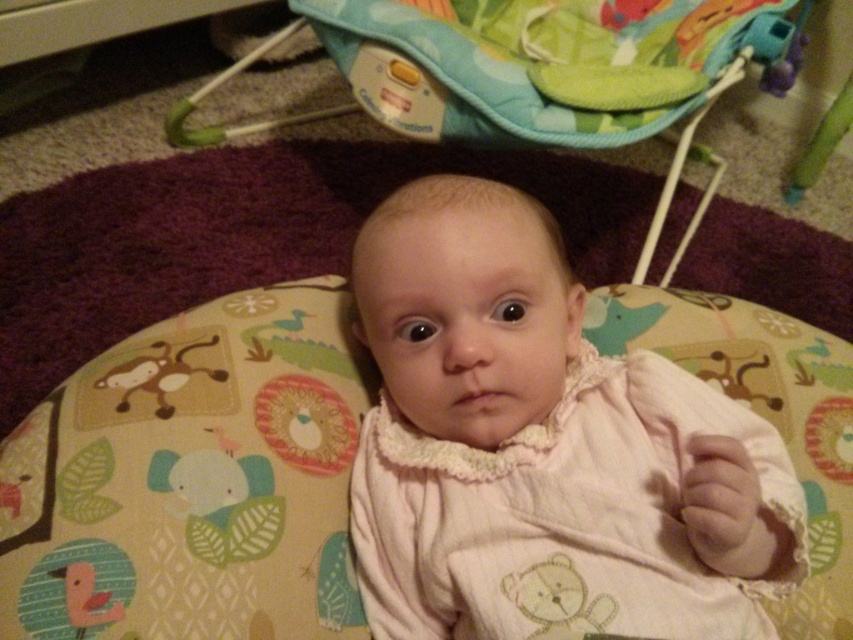
You are a parent trying to choose between placing your baby in the soft fabric baby bed at center or the multicolored fabric baby carriage at center. Which option would you choose if you want the larger one?

The multicolored fabric baby carriage at center is larger than the soft fabric baby bed at center, so you should choose the multicolored fabric baby carriage at center.

You are a parent holding a toy that is 12 inches long. You want to place it in front of the baby so that the baby can easily reach it. Given the point marked at coordinate point (392, 504), which is 28.80 inches away from you, can you determine if placing the toy at that point would be within the baby s reach?

The point marked at coordinate point (392, 504) is 28.80 inches away from the viewer. Since the toy is 12 inches long, placing it at that point would require the baby to reach 28.80 inches away, which is likely beyond the baby s typical reach range. Therefore, placing the toy at that point may not be within the baby s reach.